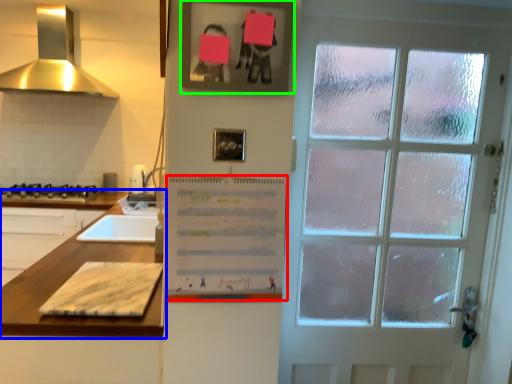
Question: Which is farther away from bulletin board (highlighted by a red box)? countertop (highlighted by a blue box) or picture frame (highlighted by a green box)?

Choices:
 (A) countertop
 (B) picture frame

Answer: (B)